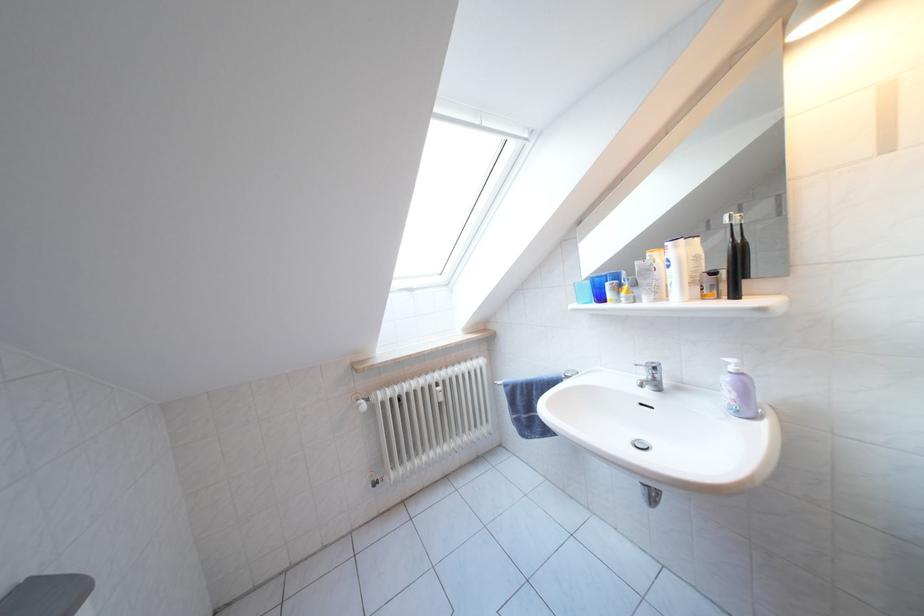
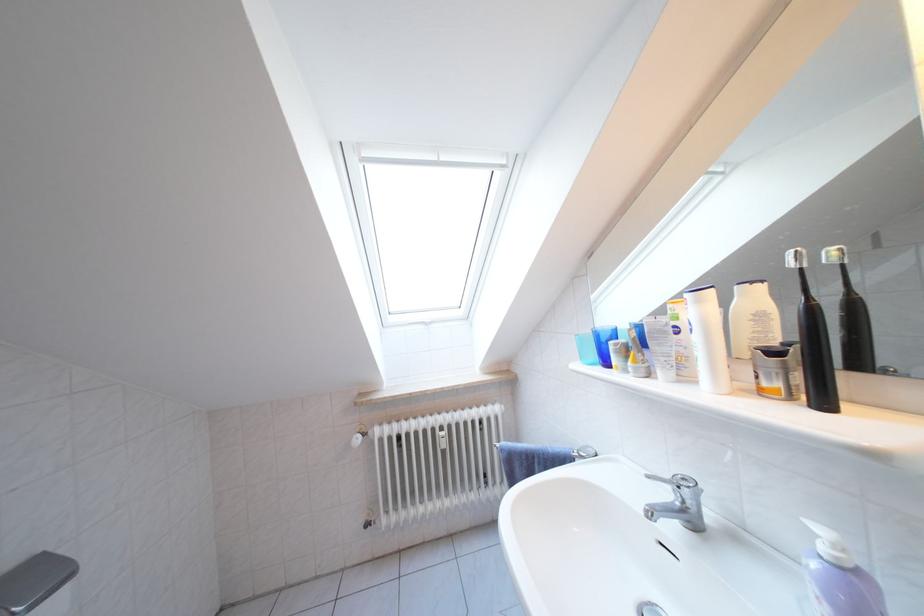
Where in the second image is the point corresponding to (x=685, y=252) from the first image?

(708, 306)